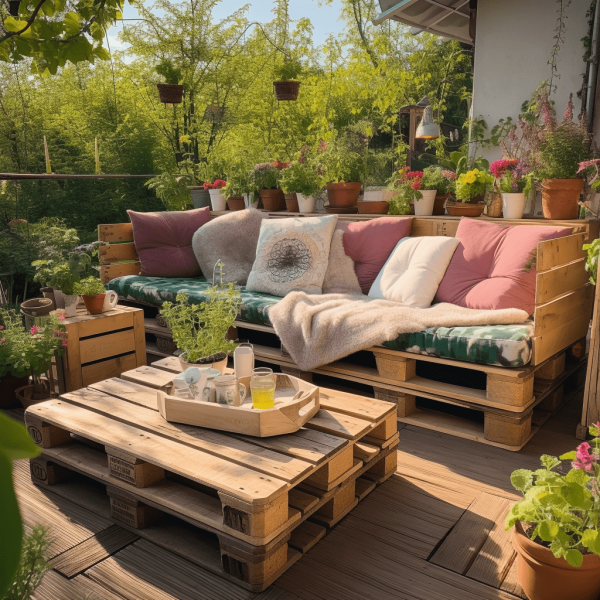
Find the location of a particular element. The image size is (600, 600). hanging lamp is located at coordinates (429, 131).